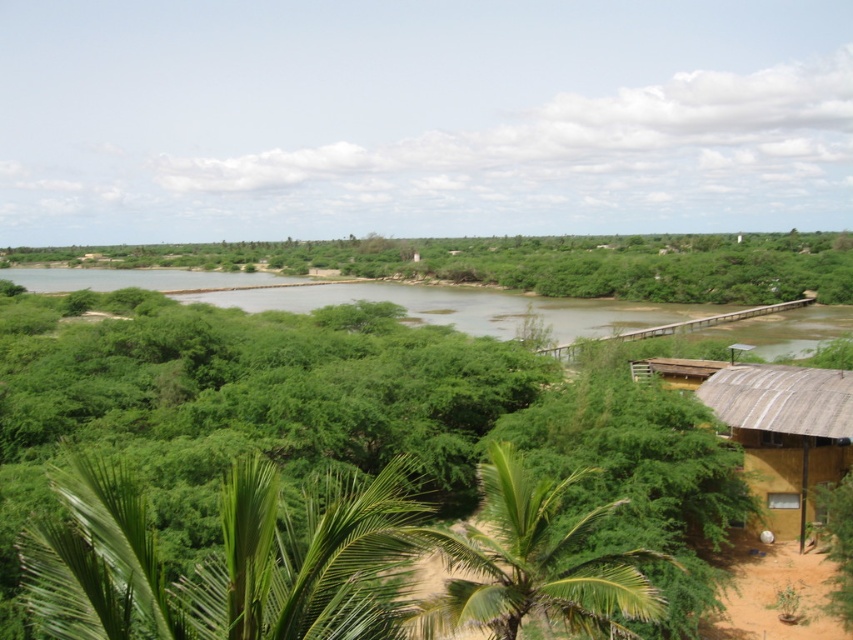
You are standing at the edge of the water and want to reach the brown corrugated metal hut at lower right without walking through the green leafy palm tree at lower center. Which direction should you walk to go around the tree?

The green leafy palm tree at lower center is in front of the brown corrugated metal hut at lower right. To avoid walking through the tree, you should walk around it either to the left or right side of the tree to reach the hut.

You are standing on the wooden pier and want to take a photo of both the green leafy jungle at center and the green leafy palm tree at lower center. Which one should you zoom in on more to ensure both fit in the frame?

Since the green leafy jungle at center is taller than the green leafy palm tree at lower center, you should zoom in more on the green leafy jungle at center to accommodate its height while still capturing the palm tree.

You are standing on the wooden pier and want to take a photo that includes both the green leafy jungle at center and the green leafy palm tree at lower center. Which object should be placed closer to the camera to ensure both are in focus?

The green leafy palm tree at lower center is behind the green leafy jungle at center, so to ensure both are in focus, the green leafy jungle at center should be closer to the camera.